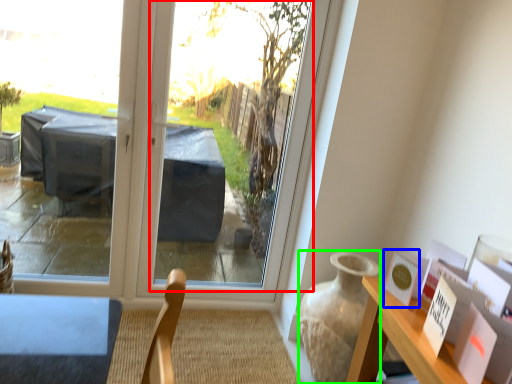
Question: Based on their relative distances, which object is farther from window screen (highlighted by a red box)? Choose from postcard (highlighted by a blue box) and vase (highlighted by a green box).

Choices:
 (A) postcard
 (B) vase

Answer: (A)